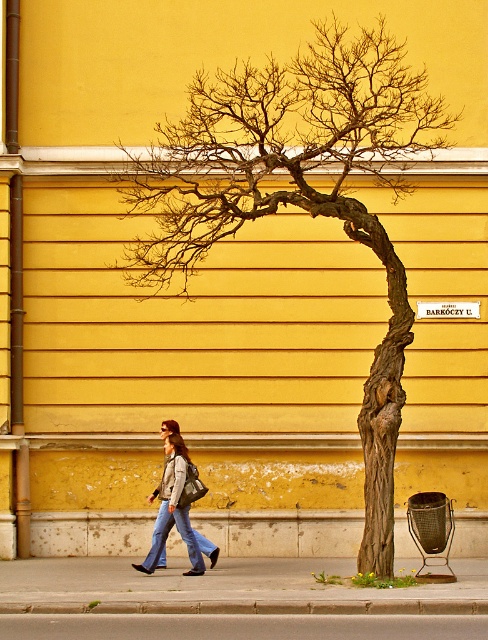
Question: Does gray concrete pavement at lower center lie in front of denim jeans at lower left?

Choices:
 (A) no
 (B) yes

Answer: (B)

Question: Can you confirm if gray concrete pavement at lower center is bigger than denim jeans at lower left?

Choices:
 (A) yes
 (B) no

Answer: (A)

Question: Which point appears closest to the camera in this image?

Choices:
 (A) (391, 252)
 (B) (34, 580)

Answer: (A)

Question: Which object appears closest to the camera in this image?

Choices:
 (A) gray concrete pavement at lower center
 (B) brown textured tree trunk at center
 (C) denim jacket at lower left

Answer: (A)

Question: Does gray concrete sidewalk at lower center have a smaller size compared to denim jacket at lower left?

Choices:
 (A) yes
 (B) no

Answer: (A)

Question: Which of the following is the farthest from the observer?

Choices:
 (A) gray concrete pavement at lower center
 (B) gray concrete sidewalk at lower center
 (C) denim jeans at lower left
 (D) brown textured tree trunk at center

Answer: (D)